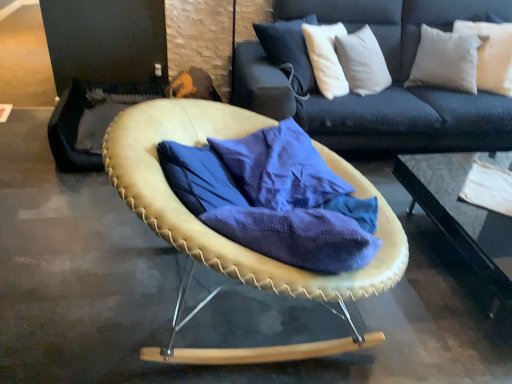
Question: Does leather-like tan chair at center appear on the left side of transparent glass table at center?

Choices:
 (A) yes
 (B) no

Answer: (A)

Question: Considering the relative positions of leather-like tan chair at center and transparent glass table at center in the image provided, is leather-like tan chair at center to the right of transparent glass table at center from the viewer's perspective?

Choices:
 (A) yes
 (B) no

Answer: (B)

Question: Can you confirm if leather-like tan chair at center is taller than transparent glass table at center?

Choices:
 (A) yes
 (B) no

Answer: (A)

Question: Does leather-like tan chair at center turn towards transparent glass table at center?

Choices:
 (A) no
 (B) yes

Answer: (A)

Question: Can we say leather-like tan chair at center lies outside transparent glass table at center?

Choices:
 (A) no
 (B) yes

Answer: (B)

Question: From a real-world perspective, is leather-like tan chair at center positioned over transparent glass table at center based on gravity?

Choices:
 (A) no
 (B) yes

Answer: (B)

Question: From the image's perspective, is blue textured fabric at center above white soft pillow at upper right?

Choices:
 (A) yes
 (B) no

Answer: (B)

Question: Does blue textured fabric at center have a lesser height compared to white soft pillow at upper right?

Choices:
 (A) yes
 (B) no

Answer: (A)

Question: Considering the relative sizes of blue textured fabric at center and white soft pillow at upper right in the image provided, is blue textured fabric at center taller than white soft pillow at upper right?

Choices:
 (A) no
 (B) yes

Answer: (A)

Question: From a real-world perspective, is blue textured fabric at center located higher than white soft pillow at upper right?

Choices:
 (A) yes
 (B) no

Answer: (B)

Question: Would you say blue textured fabric at center is a long distance from white soft pillow at upper right?

Choices:
 (A) yes
 (B) no

Answer: (A)

Question: Considering the relative sizes of blue textured fabric at center and white soft pillow at upper right in the image provided, is blue textured fabric at center bigger than white soft pillow at upper right?

Choices:
 (A) yes
 (B) no

Answer: (A)

Question: From a real-world perspective, is white soft pillow at upper right physically below leather-like tan chair at center?

Choices:
 (A) no
 (B) yes

Answer: (A)